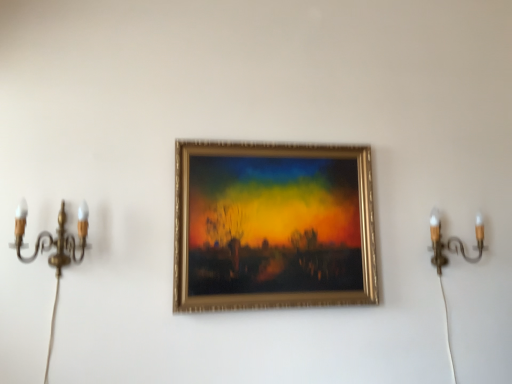
Question: From the image's perspective, is gold brass candle holder at left, placed as the second candle holder when sorted from right to left, above or below gold metallic candle holder at right, marked as the first candle holder in a back-to-front arrangement?

Choices:
 (A) below
 (B) above

Answer: (B)

Question: Relative to gold metallic candle holder at right, the 2th candle holder viewed from the front, is gold brass candle holder at left, placed as the second candle holder when sorted from right to left, in front or behind?

Choices:
 (A) front
 (B) behind

Answer: (A)

Question: Considering the real-world distances, which object is closest to the gold brass candle holder at left, placed as the second candle holder when sorted from right to left?

Choices:
 (A) gold metallic picture frame at center
 (B) gold metallic candle holder at right, the second candle holder when ordered from left to right

Answer: (A)

Question: Which object is positioned closest to the gold metallic candle holder at right, the 2th candle holder viewed from the front?

Choices:
 (A) gold metallic picture frame at center
 (B) gold brass candle holder at left, the second candle holder positioned from the back

Answer: (A)